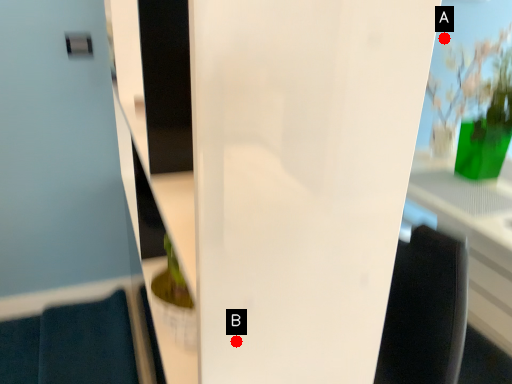
Question: Two points are circled on the image, labeled by A and B beside each circle. Which point is farther from the camera taking this photo?

Choices:
 (A) A is further
 (B) B is further

Answer: (A)